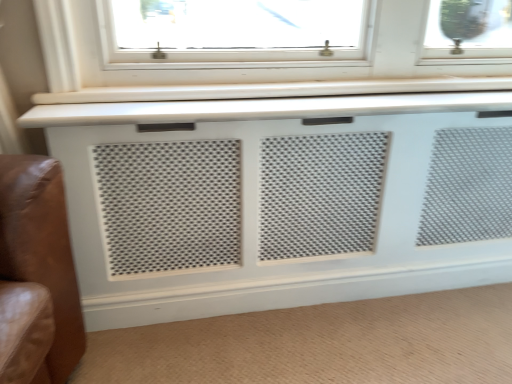
Question: Is white perforated grille at center bigger or smaller than white perforated panel at lower center?

Choices:
 (A) big
 (B) small

Answer: (A)

Question: Would you say white perforated grille at center is to the left or to the right of white perforated panel at lower center in the picture?

Choices:
 (A) right
 (B) left

Answer: (A)

Question: Considering the positions of white perforated grille at center and white perforated panel at lower center in the image, is white perforated grille at center wider or thinner than white perforated panel at lower center?

Choices:
 (A) wide
 (B) thin

Answer: (B)

Question: From a real-world perspective, is white perforated panel at lower center above or below white perforated grille at center?

Choices:
 (A) below
 (B) above

Answer: (A)

Question: Looking at the image, does white perforated panel at lower center seem bigger or smaller compared to white perforated grille at center?

Choices:
 (A) small
 (B) big

Answer: (A)

Question: Do you think white perforated panel at lower center is within white perforated grille at center, or outside of it?

Choices:
 (A) outside
 (B) inside

Answer: (A)

Question: Considering the positions of white perforated panel at lower center and white perforated grille at center in the image, is white perforated panel at lower center taller or shorter than white perforated grille at center?

Choices:
 (A) short
 (B) tall

Answer: (A)